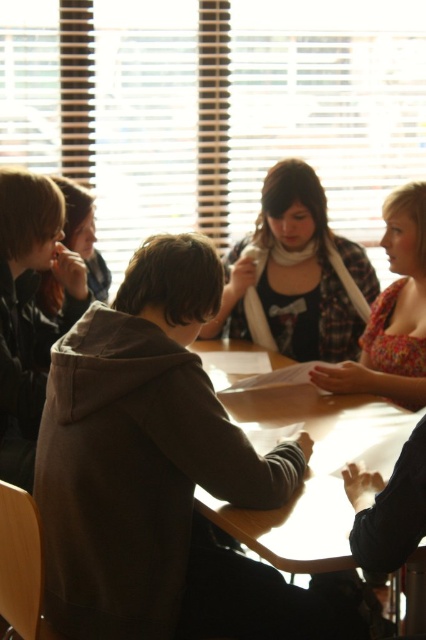
Question: Does plaid fabric shirt at center come behind floral fabric dress at right?

Choices:
 (A) no
 (B) yes

Answer: (B)

Question: Which of the following is the farthest from the observer?

Choices:
 (A) wooden table at center
 (B) floral fabric dress at right
 (C) dark brown hoodie at center

Answer: (B)

Question: Estimate the real-world distances between objects in this image. Which object is farther from the dark brown hoodie at center?

Choices:
 (A) plaid fabric shirt at center
 (B) wooden table at center

Answer: (A)

Question: Which object is farther from the camera taking this photo?

Choices:
 (A) plaid fabric shirt at center
 (B) floral fabric dress at right
 (C) dark brown hoodie at center
 (D) wooden table at center

Answer: (A)

Question: Considering the relative positions of plaid fabric shirt at center and floral fabric dress at right in the image provided, where is plaid fabric shirt at center located with respect to floral fabric dress at right?

Choices:
 (A) left
 (B) right

Answer: (A)

Question: Can you confirm if wooden table at center is positioned to the right of floral fabric dress at right?

Choices:
 (A) no
 (B) yes

Answer: (A)